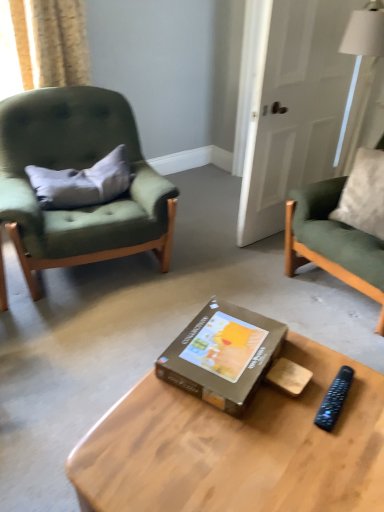
I want to click on blank space situated above brown cardboard box at center (from a real-world perspective), so click(x=235, y=343).